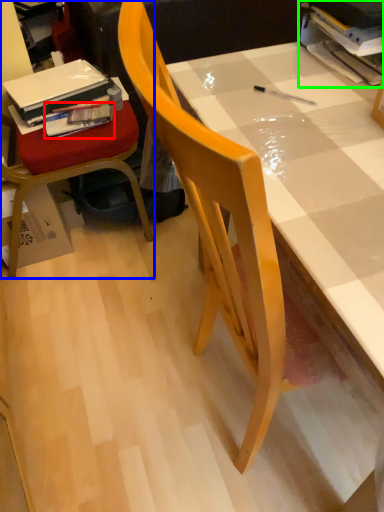
Question: Based on their relative distances, which object is nearer to book (highlighted by a red box)? Choose from chair (highlighted by a blue box) and book (highlighted by a green box).

Choices:
 (A) chair
 (B) book

Answer: (A)